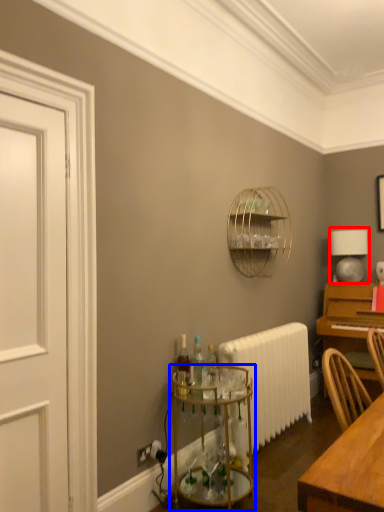
Question: Among these objects, which one is nearest to the camera, table lamp (highlighted by a red box) or glass table (highlighted by a blue box)?

Choices:
 (A) table lamp
 (B) glass table

Answer: (B)